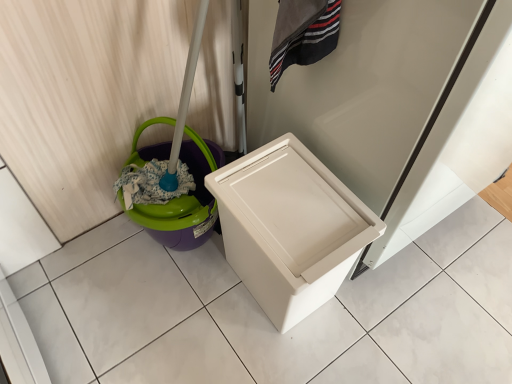
Question: Considering the positions of purple plastic potty at left and white plastic waste container at center in the image, is purple plastic potty at left bigger or smaller than white plastic waste container at center?

Choices:
 (A) small
 (B) big

Answer: (A)

Question: Is purple plastic potty at left taller or shorter than white plastic waste container at center?

Choices:
 (A) tall
 (B) short

Answer: (B)

Question: Considering their positions, is purple plastic potty at left located in front of or behind white plastic waste container at center?

Choices:
 (A) behind
 (B) front

Answer: (A)

Question: From a real-world perspective, relative to purple plastic potty at left, is white plastic waste container at center vertically above or below?

Choices:
 (A) above
 (B) below

Answer: (A)

Question: Does point (256, 155) appear closer or farther from the camera than point (205, 173)?

Choices:
 (A) farther
 (B) closer

Answer: (B)

Question: Considering the positions of white plastic waste container at center and purple plastic potty at left in the image, is white plastic waste container at center bigger or smaller than purple plastic potty at left?

Choices:
 (A) big
 (B) small

Answer: (A)

Question: Which is correct: white plastic waste container at center is inside purple plastic potty at left, or outside of it?

Choices:
 (A) inside
 (B) outside

Answer: (B)